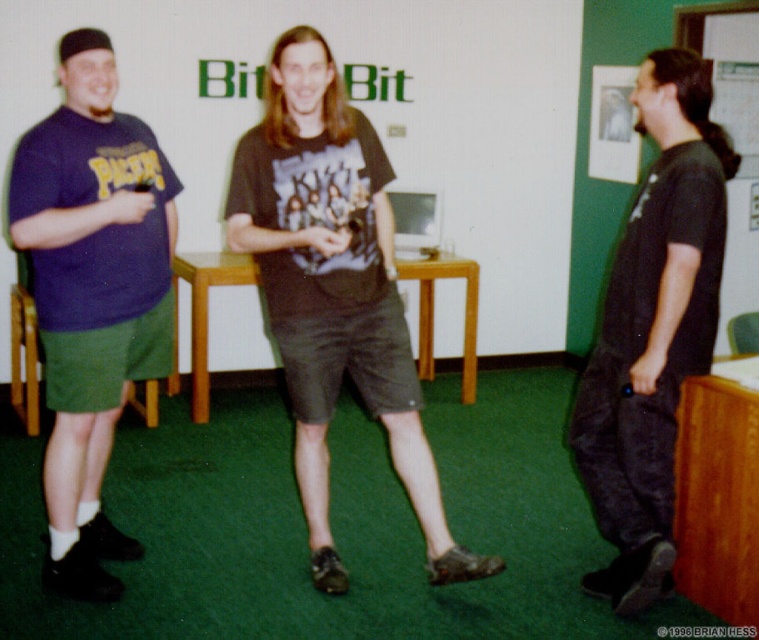
You are standing in the room and want to place a small sticker on the wall. You have two points to choose from. The first point is at coordinate point [323,403] and the second is at point [93,429]. Which point is closer to you so that the sticker will be easier to reach?

Point [323,403] is closer to the camera than point [93,429], so the sticker placed there will be easier to reach.

Consider the image. You are standing at the point labeled as point (690,248) and want to walk to the door located at point (354,259). Is there any obstruction between your current position and the door?

The point (354,259) is behind point (690,248), so there is an obstruction between your current position and the door.